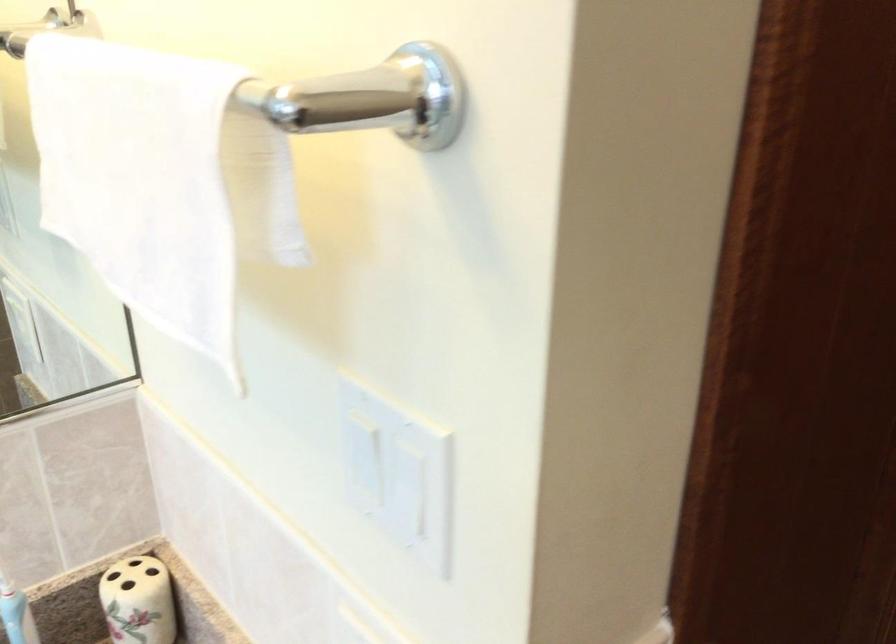
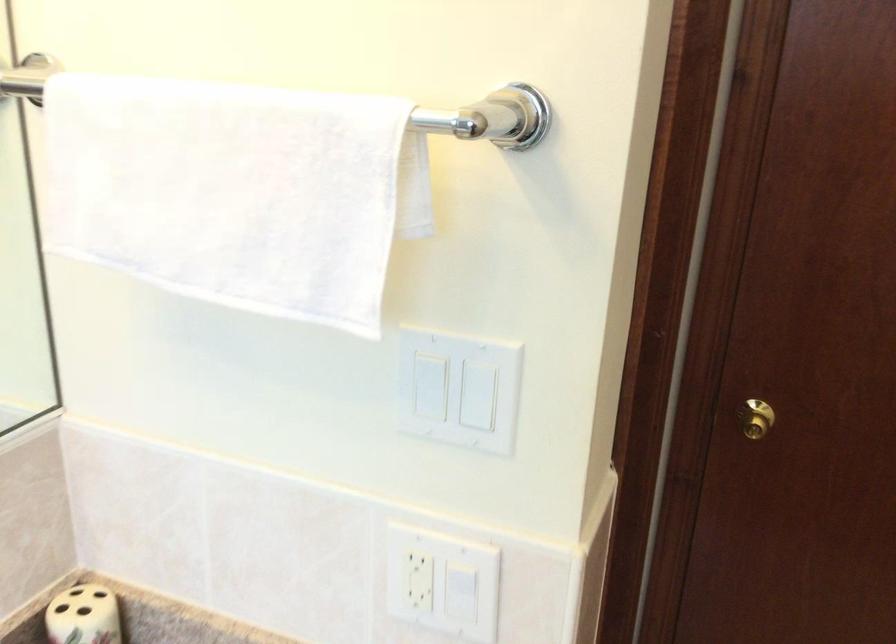
The point at [426,482] is marked in the first image. Where is the corresponding point in the second image?

(483, 395)